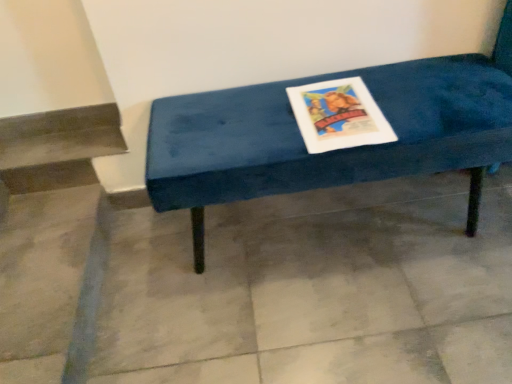
Find the location of a particular element. This screenshot has height=384, width=512. gray tile floor at center is located at coordinates (315, 289).

This screenshot has width=512, height=384. Describe the element at coordinates (315, 289) in the screenshot. I see `gray tile floor at center` at that location.

Identify the location of velvet blue bench at center. tap(332, 151).

What do you see at coordinates (332, 151) in the screenshot?
I see `velvet blue bench at center` at bounding box center [332, 151].

Measure the distance between velvet blue bench at center and camera.

They are 3.32 feet apart.

Locate an element on the screen. This screenshot has width=512, height=384. gray tile floor at center is located at coordinates (315, 289).

Between gray tile floor at center and velvet blue bench at center, which one appears on the left side from the viewer's perspective?

gray tile floor at center.

Considering the positions of objects gray tile floor at center and velvet blue bench at center in the image provided, who is in front, gray tile floor at center or velvet blue bench at center?

velvet blue bench at center is closer to the camera.

Is point (389, 189) behind point (202, 270)?

Yes, it is behind point (202, 270).

From the image's perspective, is gray tile floor at center positioned above or below velvet blue bench at center?

gray tile floor at center is situated lower than velvet blue bench at center in the image.

From the picture: From a real-world perspective, is gray tile floor at center under velvet blue bench at center?

Yes, from a real-world perspective, gray tile floor at center is under velvet blue bench at center.

Considering the relative sizes of gray tile floor at center and velvet blue bench at center in the image provided, is gray tile floor at center wider than velvet blue bench at center?

Yes, gray tile floor at center is wider than velvet blue bench at center.

Which of these two, gray tile floor at center or velvet blue bench at center, stands taller?

With more height is velvet blue bench at center.

Considering the sizes of objects gray tile floor at center and velvet blue bench at center in the image provided, who is smaller, gray tile floor at center or velvet blue bench at center?

gray tile floor at center is smaller.

Is gray tile floor at center positioned beyond the bounds of velvet blue bench at center?

That's correct, gray tile floor at center is outside of velvet blue bench at center.

In the scene shown: Is the surface of gray tile floor at center in direct contact with velvet blue bench at center?

There is a gap between gray tile floor at center and velvet blue bench at center.

Is gray tile floor at center facing towards velvet blue bench at center?

No.

What's the angular difference between gray tile floor at center and velvet blue bench at center's facing directions?

They differ by 91.7 degrees in their facing directions.

How much distance is there between gray tile floor at center and velvet blue bench at center?

A distance of 40.33 centimeters exists between gray tile floor at center and velvet blue bench at center.

The image size is (512, 384). I want to click on furniture on the right side of gray tile floor at center, so click(332, 151).

Is velvet blue bench at center to the left or to the right of gray tile floor at center in the image?

Clearly, velvet blue bench at center is on the right of gray tile floor at center in the image.

Is velvet blue bench at center in front of gray tile floor at center?

Yes, the depth of velvet blue bench at center is less than that of gray tile floor at center.

Considering the points (408, 63) and (241, 238), which point is behind, point (408, 63) or point (241, 238)?

The point (241, 238) is farther.

From the image's perspective, does velvet blue bench at center appear higher than gray tile floor at center?

Yes.

From a real-world perspective, between velvet blue bench at center and gray tile floor at center, who is vertically lower?

gray tile floor at center is physically lower.

Can you confirm if velvet blue bench at center is thinner than gray tile floor at center?

Yes, velvet blue bench at center is thinner than gray tile floor at center.

Who is shorter, velvet blue bench at center or gray tile floor at center?

gray tile floor at center.

Which of these two, velvet blue bench at center or gray tile floor at center, is smaller?

gray tile floor at center is smaller.

Is gray tile floor at center located within velvet blue bench at center?

No.

Is velvet blue bench at center placed right next to gray tile floor at center?

velvet blue bench at center and gray tile floor at center are not in contact.

Is velvet blue bench at center facing away from gray tile floor at center?

No.

Find the location of `concrete behind the velvet blue bench at center`. concrete behind the velvet blue bench at center is located at coordinates (315, 289).

Where is `furniture in front of the gray tile floor at center`? This screenshot has height=384, width=512. furniture in front of the gray tile floor at center is located at coordinates (332, 151).

Image resolution: width=512 pixels, height=384 pixels. Find the location of `concrete on the left of the velvet blue bench at center`. concrete on the left of the velvet blue bench at center is located at coordinates (315, 289).